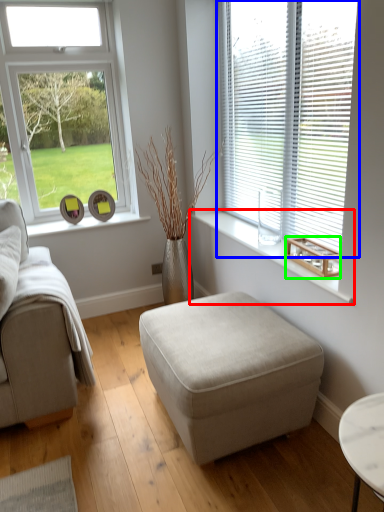
Question: Which is nearer to the window sill (highlighted by a red box)? window (highlighted by a blue box) or wood (highlighted by a green box).

Choices:
 (A) window
 (B) wood

Answer: (B)